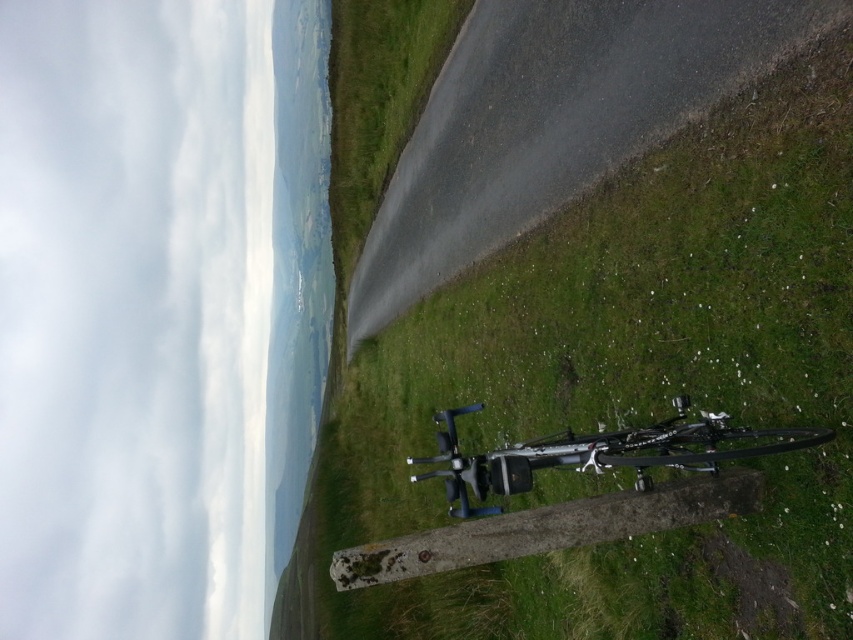
Who is lower down, green grass at lower right or metallic silver drone at center?

metallic silver drone at center is below.

Is the position of green grass at lower right more distant than that of metallic silver drone at center?

That is True.

At what (x,y) coordinates should I click in order to perform the action: click on green grass at lower right. Please return your answer as a coordinate pair (x, y). The height and width of the screenshot is (640, 853). Looking at the image, I should click on (608, 321).